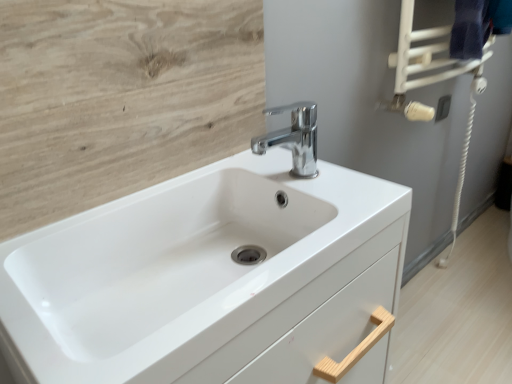
The height and width of the screenshot is (384, 512). What are the coordinates of `white glossy sink at center` in the screenshot? It's located at (212, 281).

Measure the distance between point (3, 206) and camera.

The depth of point (3, 206) is 23.86 inches.

Identify the location of chrome metallic faucet at center. (294, 137).

Does white glossy sink at center turn towards light wood/texture at upper left?

No, white glossy sink at center is not turned towards light wood/texture at upper left.

Image resolution: width=512 pixels, height=384 pixels. Find the location of `plywood above the white glossy sink at center (from a real-world perspective)`. plywood above the white glossy sink at center (from a real-world perspective) is located at coordinates (119, 98).

From the image's perspective, is white glossy sink at center located above light wood/texture at upper left?

No.

Consider the image. Can you tell me how much white glossy sink at center and light wood/texture at upper left differ in facing direction?

0.397 degrees separate the facing orientations of white glossy sink at center and light wood/texture at upper left.

Is chrome metallic faucet at center bigger or smaller than white glossy sink at center?

chrome metallic faucet at center is smaller than white glossy sink at center.

From the image's perspective, which object appears higher, chrome metallic faucet at center or white glossy sink at center?

From the image's view, chrome metallic faucet at center is above.

What are the coordinates of `tap positioned vertically above the white glossy sink at center (from a real-world perspective)` in the screenshot? It's located at (294, 137).

Is point (291, 174) farther from viewer compared to point (225, 241)?

Yes.

Is chrome metallic faucet at center looking in the opposite direction of light wood/texture at upper left?

That's not correct — chrome metallic faucet at center is not looking away from light wood/texture at upper left.

Which of these two, chrome metallic faucet at center or light wood/texture at upper left, stands shorter?

chrome metallic faucet at center is shorter.

Does chrome metallic faucet at center lie behind light wood/texture at upper left?

Yes, chrome metallic faucet at center is behind light wood/texture at upper left.

Is chrome metallic faucet at center oriented towards dark blue fabric towel bar at upper right?

No, chrome metallic faucet at center does not turn towards dark blue fabric towel bar at upper right.

Would you say chrome metallic faucet at center contains dark blue fabric towel bar at upper right?

Definitely not — dark blue fabric towel bar at upper right is not inside chrome metallic faucet at center.

Considering the relative positions of chrome metallic faucet at center and dark blue fabric towel bar at upper right in the image provided, is chrome metallic faucet at center behind dark blue fabric towel bar at upper right?

No, chrome metallic faucet at center is in front of dark blue fabric towel bar at upper right.

Which is behind, point (314, 106) or point (412, 4)?

The point (412, 4) is more distant.

Which is more to the right, light wood/texture at upper left or chrome metallic faucet at center?

From the viewer's perspective, chrome metallic faucet at center appears more on the right side.

Does point (89, 187) come behind point (314, 124)?

No.

Considering the sizes of objects light wood/texture at upper left and chrome metallic faucet at center in the image provided, who is smaller, light wood/texture at upper left or chrome metallic faucet at center?

chrome metallic faucet at center is smaller.

Are light wood/texture at upper left and chrome metallic faucet at center located far from each other?

No.

Considering the points (126, 95) and (431, 80), which point is in front, point (126, 95) or point (431, 80)?

The point (126, 95) is closer to the camera.

The image size is (512, 384). What are the coordinates of `plywood on the left side of dark blue fabric towel bar at upper right` in the screenshot? It's located at (119, 98).

Could you tell me if light wood/texture at upper left is facing dark blue fabric towel bar at upper right?

No, light wood/texture at upper left is not oriented towards dark blue fabric towel bar at upper right.

What's the angular difference between light wood/texture at upper left and dark blue fabric towel bar at upper right's facing directions?

They differ by 1.09 degrees in their facing directions.

Is white glossy sink at center positioned before dark blue fabric towel bar at upper right?

Yes, the depth of white glossy sink at center is less than that of dark blue fabric towel bar at upper right.

Where is `sink on the left of the dark blue fabric towel bar at upper right`? The width and height of the screenshot is (512, 384). sink on the left of the dark blue fabric towel bar at upper right is located at coordinates (212, 281).

Is white glossy sink at center next to dark blue fabric towel bar at upper right?

No, white glossy sink at center is not next to dark blue fabric towel bar at upper right.

Find the location of a particular element. This screenshot has width=512, height=384. plywood that appears behind the white glossy sink at center is located at coordinates (119, 98).

Where is `sink below the chrome metallic faucet at center (from the image's perspective)`? This screenshot has height=384, width=512. sink below the chrome metallic faucet at center (from the image's perspective) is located at coordinates (212, 281).

Based on their spatial positions, is white glossy sink at center or chrome metallic faucet at center closer to light wood/texture at upper left?

Based on the image, white glossy sink at center appears to be nearer to light wood/texture at upper left.

Considering their positions, is dark blue fabric towel bar at upper right positioned closer to white glossy sink at center than light wood/texture at upper left?

Among the two, light wood/texture at upper left is located nearer to white glossy sink at center.

When comparing their distances from white glossy sink at center, does light wood/texture at upper left or chrome metallic faucet at center seem further?

chrome metallic faucet at center lies further to white glossy sink at center than the other object.

From the image, which object appears to be farther from light wood/texture at upper left, dark blue fabric towel bar at upper right or white glossy sink at center?

Among the two, dark blue fabric towel bar at upper right is located further to light wood/texture at upper left.

Based on their spatial positions, is chrome metallic faucet at center or dark blue fabric towel bar at upper right closer to light wood/texture at upper left?

chrome metallic faucet at center is positioned closer to the anchor light wood/texture at upper left.

When comparing their distances from light wood/texture at upper left, does dark blue fabric towel bar at upper right or chrome metallic faucet at center seem further?

dark blue fabric towel bar at upper right is further to light wood/texture at upper left.

Based on their spatial positions, is light wood/texture at upper left or dark blue fabric towel bar at upper right closer to chrome metallic faucet at center?

The object closer to chrome metallic faucet at center is light wood/texture at upper left.

Which object lies nearer to the anchor point dark blue fabric towel bar at upper right, light wood/texture at upper left or white glossy sink at center?

light wood/texture at upper left is positioned closer to the anchor dark blue fabric towel bar at upper right.

Where is `tap between dark blue fabric towel bar at upper right and white glossy sink at center from top to bottom`? tap between dark blue fabric towel bar at upper right and white glossy sink at center from top to bottom is located at coordinates (294, 137).

This screenshot has width=512, height=384. What are the coordinates of `plywood between dark blue fabric towel bar at upper right and white glossy sink at center in the vertical direction` in the screenshot? It's located at (119, 98).

Find the location of a particular element. The height and width of the screenshot is (384, 512). tap between light wood/texture at upper left and dark blue fabric towel bar at upper right in the horizontal direction is located at coordinates (294, 137).

Find the location of `tap between light wood/texture at upper left and white glossy sink at center vertically`. tap between light wood/texture at upper left and white glossy sink at center vertically is located at coordinates (x=294, y=137).